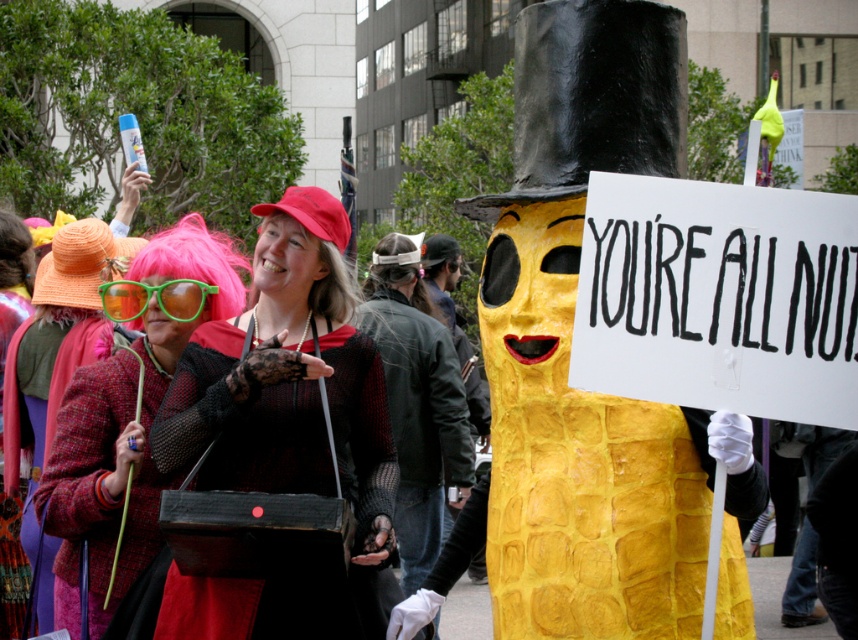
You are a photographer trying to capture the green plastic cane at left in your shot. Based on the scene description, where should you position your camera to ensure the cane is visible in the frame?

The green plastic cane at left is located at point (101, 483), so you should position your camera to focus on that coordinate to include the cane in the frame.

You are a photographer standing at the edge of the lively street scene. You want to capture a photo that includes both the matte black purse at center and the green plastic goggles at center. The minimum distance between the two items in your camera frame must be at least 4 feet to ensure clarity. Can you successfully include both items in a single frame without them overlapping?

The matte black purse at center is 4.25 feet away from the green plastic goggles at center. Since the required minimum distance is 4 feet, the 4.25 feet distance meets this requirement. Therefore, you can successfully include both items in a single frame without overlapping.

You are a photographer trying to capture the matte black purse at center in your shot. Given that your camera has a focus point at coordinates 0.658, 0.330, will the purse be in focus?

Yes, the matte black purse at center is located exactly at the focus point (282,420), so it will be in focus.